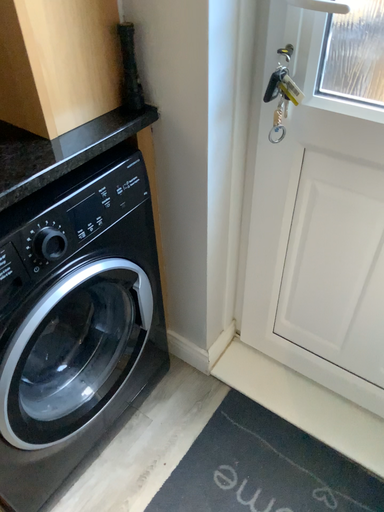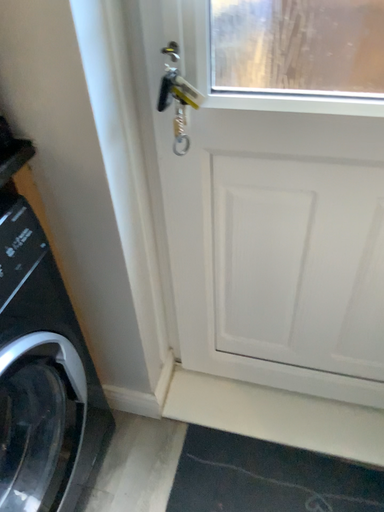
Question: Which way did the camera rotate in the video?

Choices:
 (A) rotated left
 (B) rotated right

Answer: (B)